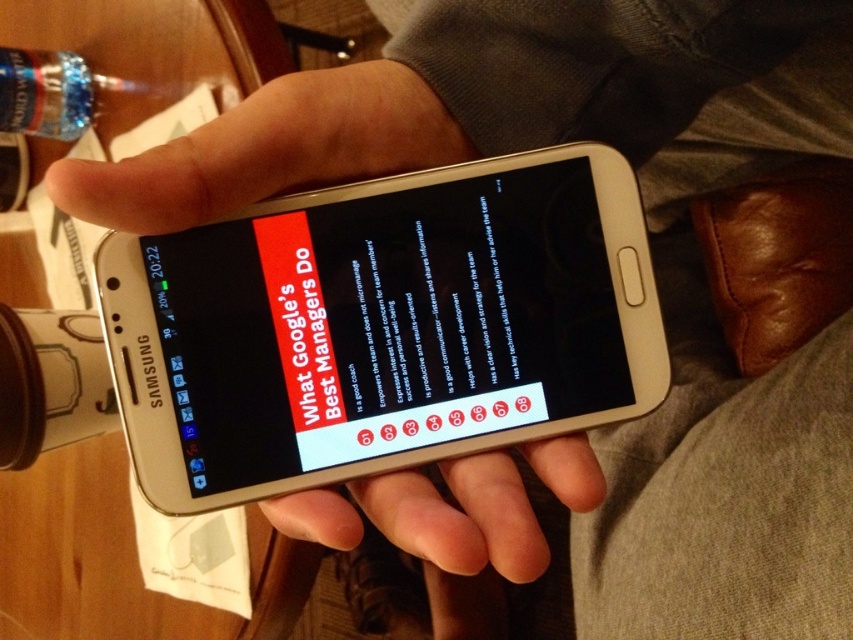
Question: Can you confirm if matte black phone at center is positioned to the right of clear plastic bottle at upper left?

Choices:
 (A) yes
 (B) no

Answer: (A)

Question: Is matte black phone at center above black glossy text message at center?

Choices:
 (A) yes
 (B) no

Answer: (B)

Question: Which of the following is the farthest from the observer?

Choices:
 (A) 422,333
 (B) 312,273
 (C) 15,124

Answer: (C)

Question: Is white paper text at upper center smaller than clear plastic bottle at upper left?

Choices:
 (A) no
 (B) yes

Answer: (B)

Question: Which point is closer to the camera?

Choices:
 (A) (59, 115)
 (B) (321, 332)

Answer: (B)

Question: Which object appears farthest from the camera in this image?

Choices:
 (A) clear plastic bottle at upper left
 (B) matte black phone at center
 (C) white paper text at upper center

Answer: (A)